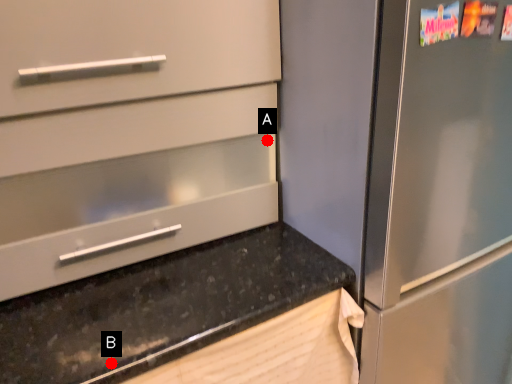
Question: Two points are circled on the image, labeled by A and B beside each circle. Which point is farther from the camera taking this photo?

Choices:
 (A) A is further
 (B) B is further

Answer: (A)